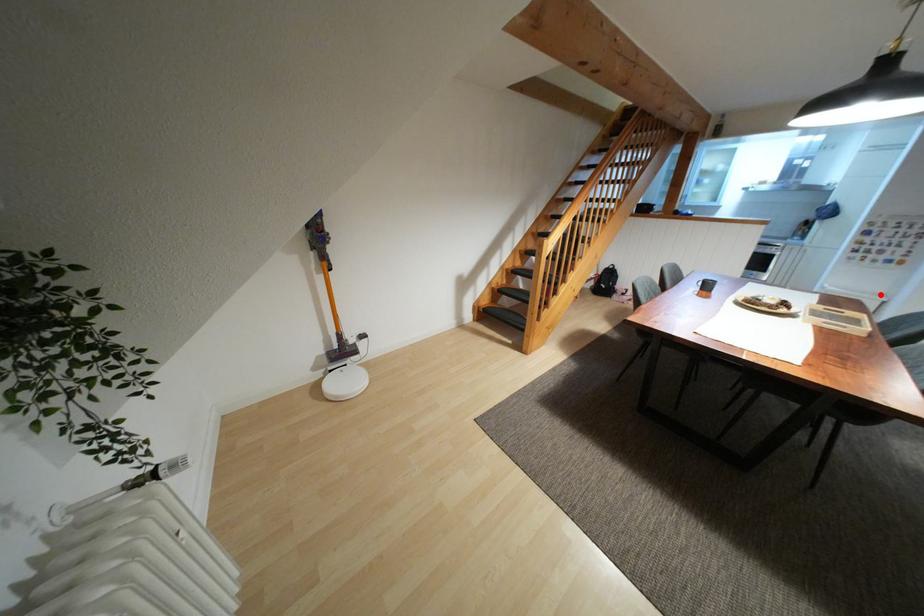
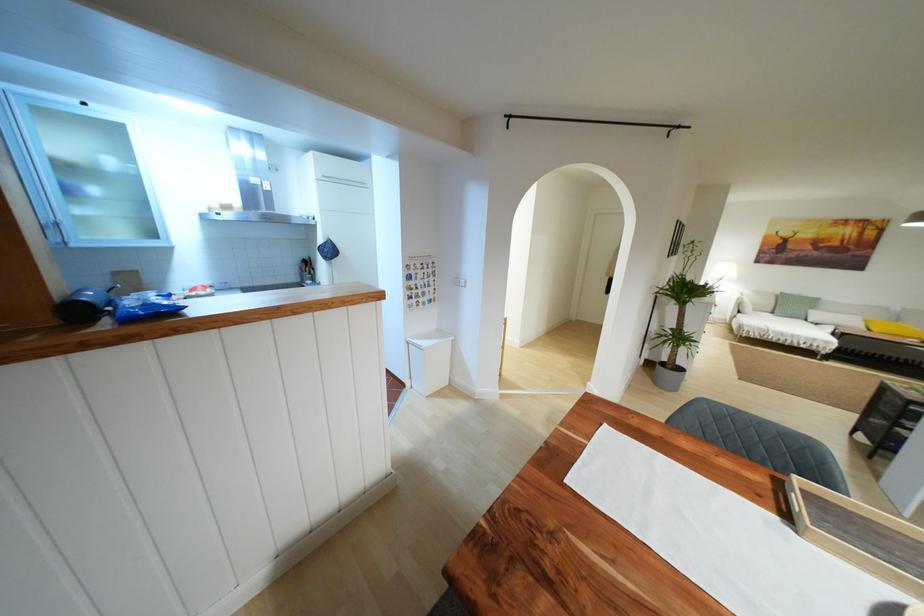
In the second image, find the point that corresponds to the highlighted location in the first image.

(439, 331)